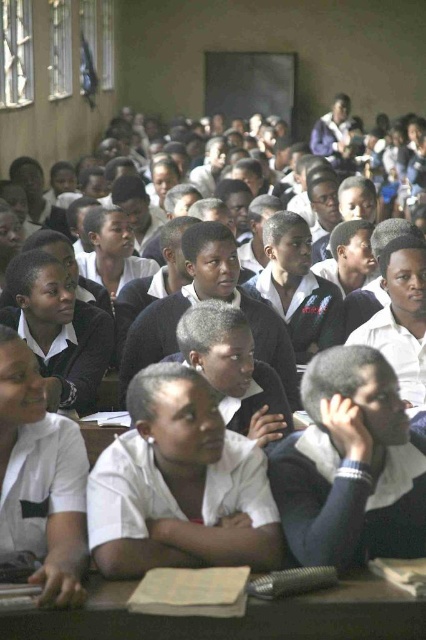
Question: Where is white matte shirt at center located in relation to wooden desk at center in the image?

Choices:
 (A) right
 (B) left

Answer: (B)

Question: Can you confirm if white matte shirt at center is positioned above wooden desk at center?

Choices:
 (A) yes
 (B) no

Answer: (A)

Question: Which point is farther to the camera?

Choices:
 (A) white matte shirt at center
 (B) wooden desk at center

Answer: (A)

Question: Among these points, which one is farthest from the camera?

Choices:
 (A) [209, 499]
 (B) [394, 612]

Answer: (A)

Question: Is white matte shirt at center bigger than wooden desk at center?

Choices:
 (A) yes
 (B) no

Answer: (A)